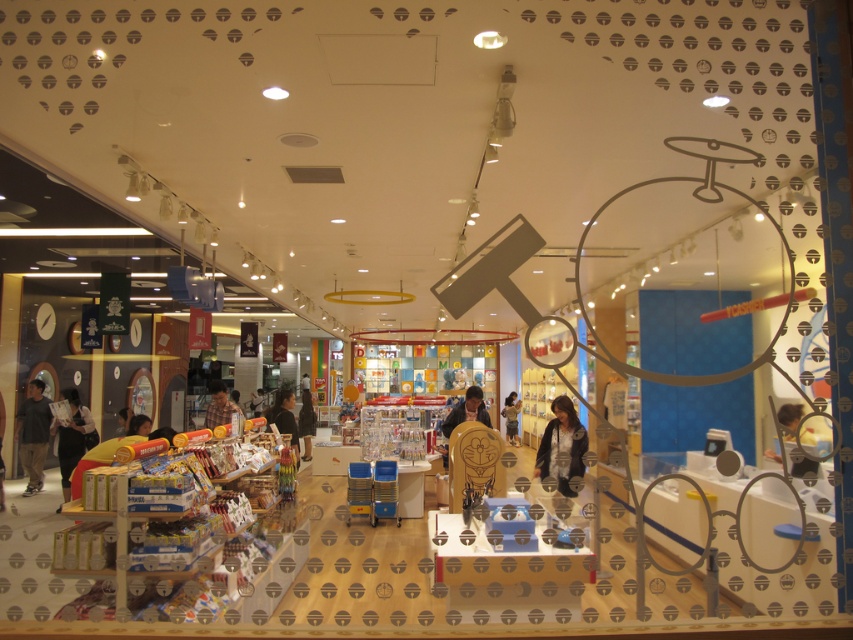
You are a customer in the toy store and want to take a photo of both the point at coordinates point (560,429) and point (305,406). Which point will appear larger in your photo?

Point (560,429) is closer to the camera than point (305,406), so it will appear larger in the photo.

You are standing in the toy store and notice two points marked on the floor. The first point is at coordinate point (567, 445) and the second is at coordinate point (79, 493). If you are facing the window with the decorative overlay, which point is closer to the back wall of the store?

Point (567, 445) is behind point (79, 493), so it is closer to the back wall of the store.